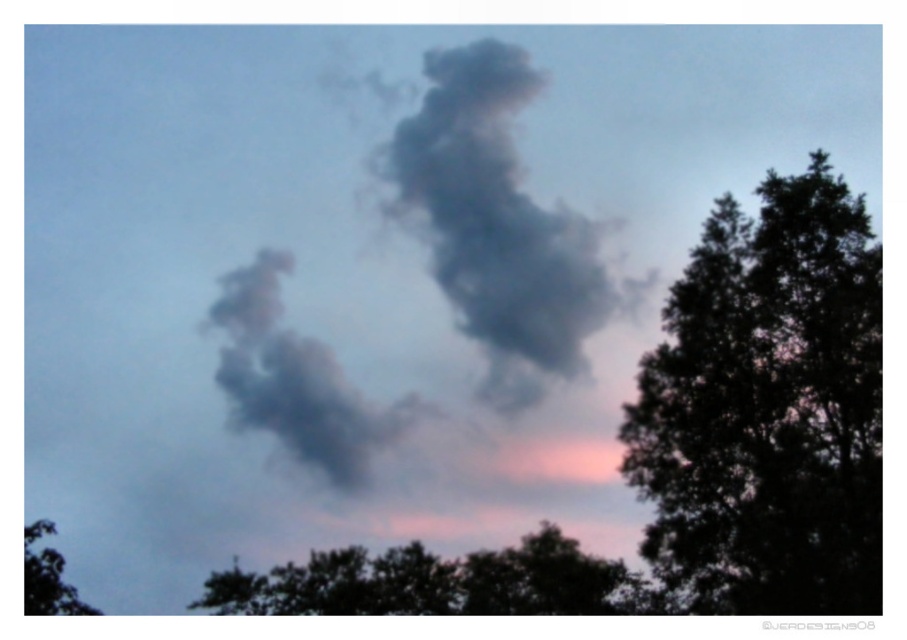
Question: Which object appears farthest from the camera in this image?

Choices:
 (A) green leafy tree at lower center
 (B) green leafy tree at lower left
 (C) gray matte cloud at center

Answer: (A)

Question: Is dark green leafy tree at right above gray matte cloud at center?

Choices:
 (A) yes
 (B) no

Answer: (B)

Question: Is gray matte cloud at center bigger than green leafy tree at lower left?

Choices:
 (A) yes
 (B) no

Answer: (A)

Question: Among these objects, which one is farthest from the camera?

Choices:
 (A) dark green leafy tree at right
 (B) green leafy tree at lower center
 (C) green leafy tree at lower left
 (D) gray matte cloud at center

Answer: (B)

Question: Among these objects, which one is farthest from the camera?

Choices:
 (A) green leafy tree at lower center
 (B) dark green leafy tree at right
 (C) gray matte cloud at center

Answer: (A)

Question: Does dark green leafy tree at right appear on the right side of gray matte cloud at center?

Choices:
 (A) no
 (B) yes

Answer: (B)